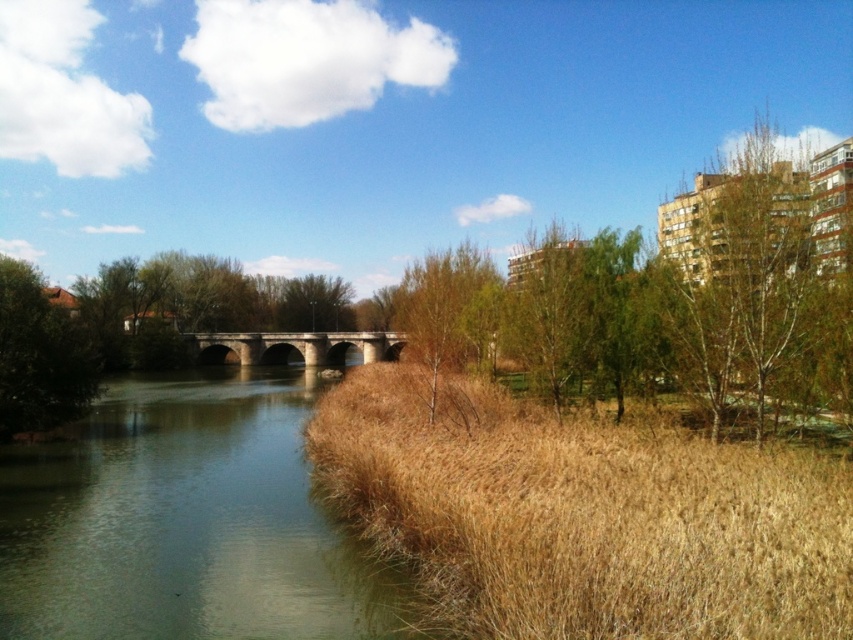
You are a gardener planning to mow the brown dry grass at lower right and trim the green leafy tree at upper right. Which area requires more attention to width when planning your work? Explain your reasoning based on the scene.

The green leafy tree at upper right requires more attention to width because its width is greater than the brown dry grass at lower right.

You are a bird looking for a place to land. You see the brown dry grass at lower right and the green leafy tree at upper right. Which one is located below the other?

The brown dry grass at lower right is positioned under the green leafy tree at upper right.